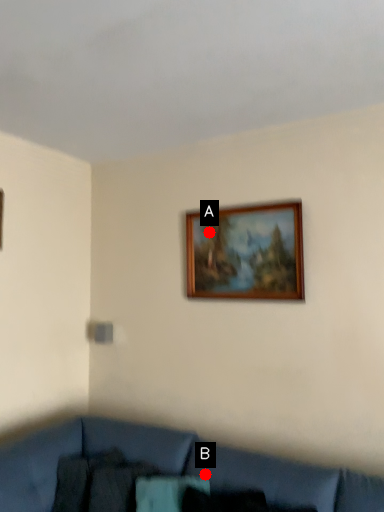
Question: Two points are circled on the image, labeled by A and B beside each circle. Which of the following is the farthest from the observer?

Choices:
 (A) A is further
 (B) B is further

Answer: (A)